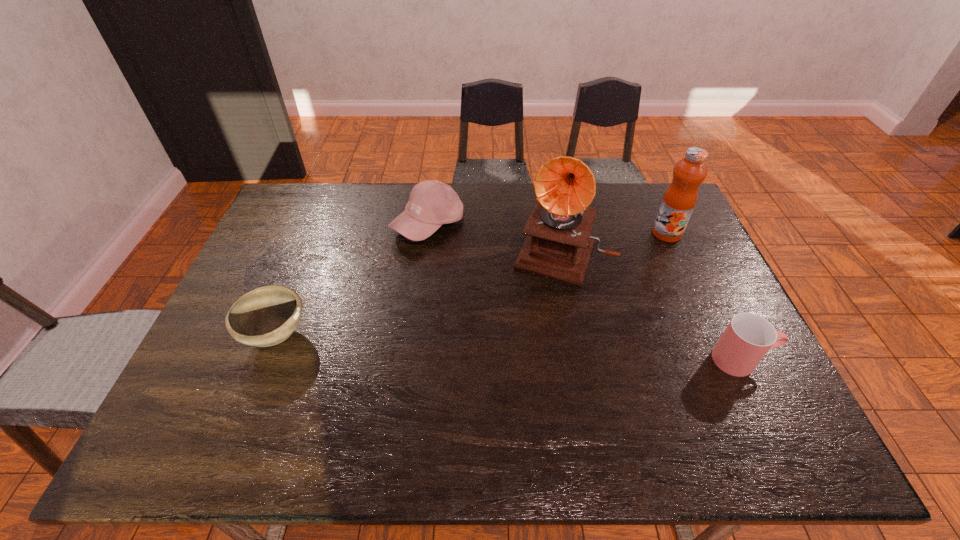
At what (x,y) coordinates should I click in order to perform the action: click on object that ranks as the closest to the cup. Please return your answer as a coordinate pair (x, y). Image resolution: width=960 pixels, height=540 pixels. Looking at the image, I should click on (558, 245).

Image resolution: width=960 pixels, height=540 pixels. Identify the location of vacant point that satisfies the following two spatial constraints: 1. on the front side of the cup; 2. on the side of the shortest object with the handle. (267, 360).